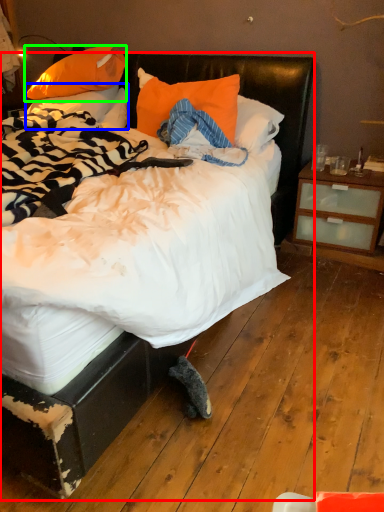
Question: Considering the real-world distances, which object is farthest from bed (highlighted by a red box)? pillow (highlighted by a blue box) or pillow (highlighted by a green box)?

Choices:
 (A) pillow
 (B) pillow

Answer: (B)